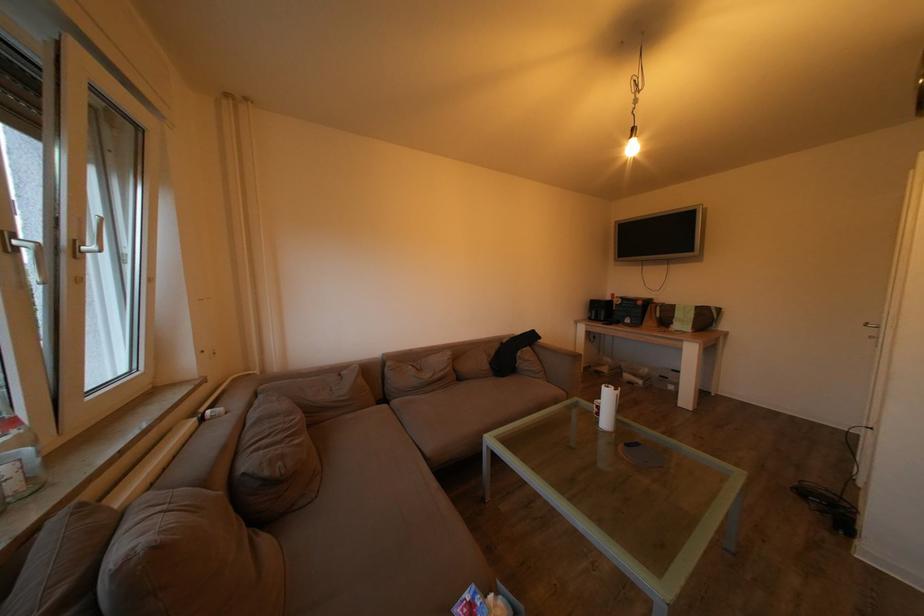
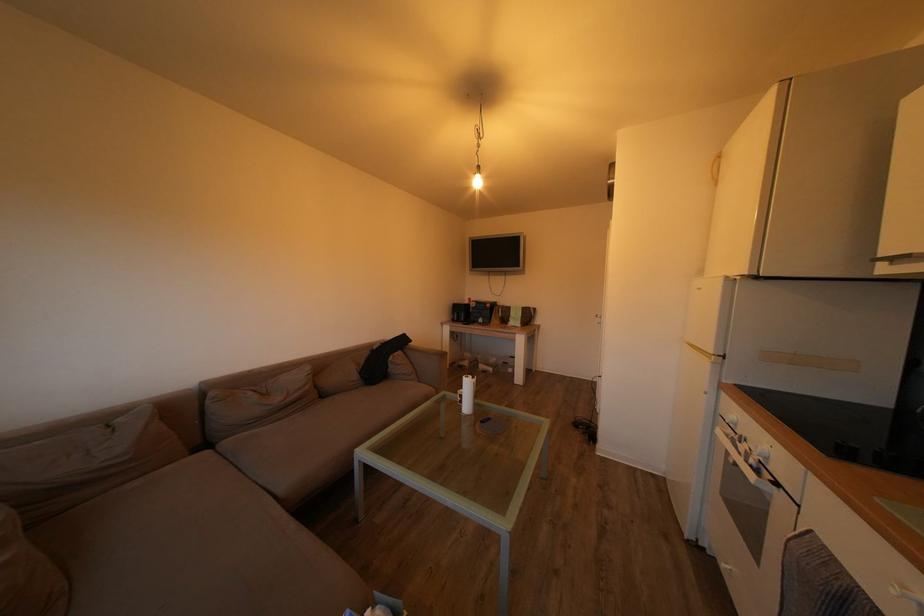
In the second image, find the point that corresponds to (x=588, y=317) in the first image.

(453, 320)